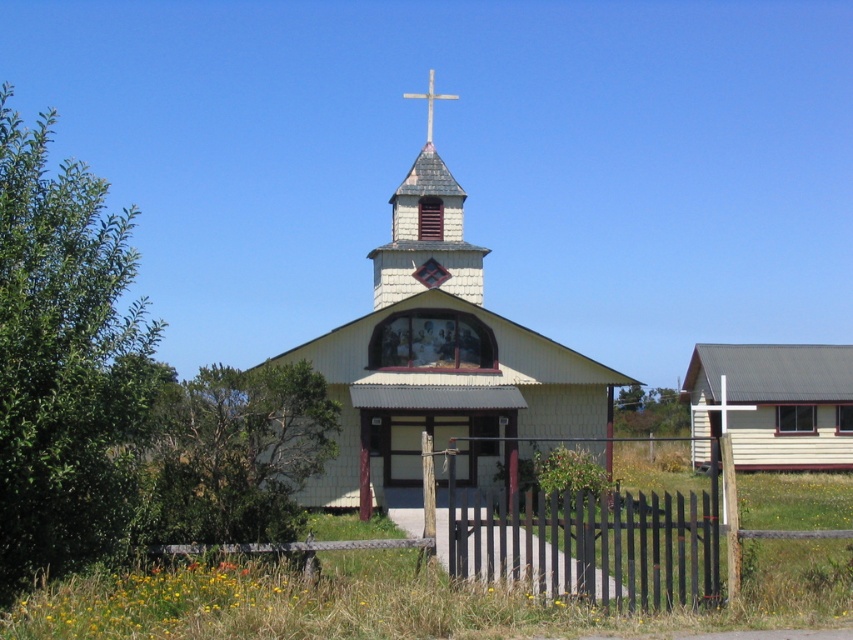
Question: Observing the image, what is the correct spatial positioning of wooden church at center in reference to white wooden cross at center?

Choices:
 (A) below
 (B) above

Answer: (B)

Question: Can you confirm if wooden church at center is wider than black wood fence at center?

Choices:
 (A) yes
 (B) no

Answer: (A)

Question: Estimate the real-world distances between objects in this image. Which object is farther from the wooden church at center?

Choices:
 (A) wooden shingles at center
 (B) white wooden cross at center

Answer: (A)

Question: Which point appears farthest from the camera in this image?

Choices:
 (A) 721,412
 (B) 553,509
 (C) 393,243
 (D) 430,129

Answer: (D)

Question: Is wooden shingles at center to the left of wooden cross at upper center from the viewer's perspective?

Choices:
 (A) no
 (B) yes

Answer: (B)

Question: Which of these objects is positioned farthest from the wooden church at center?

Choices:
 (A) white wooden cross at center
 (B) wooden shingles at center
 (C) wooden cross at upper center

Answer: (C)